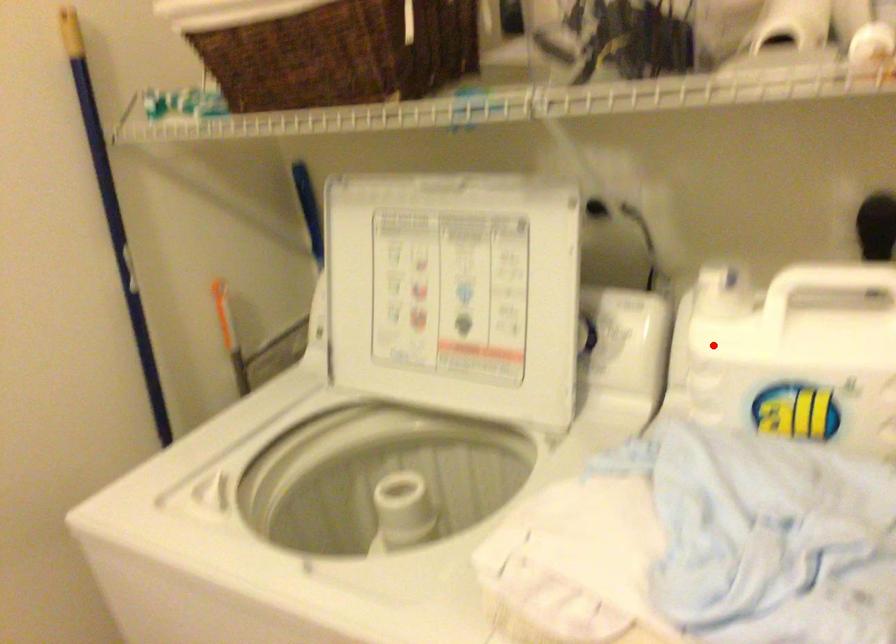
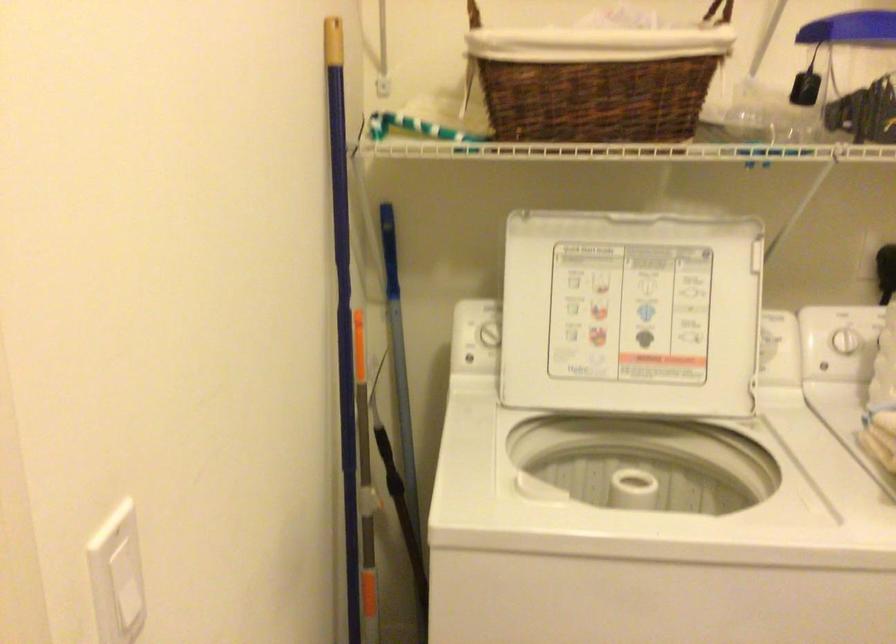
The point at the highlighted location is marked in the first image. Where is the corresponding point in the second image?

(845, 341)